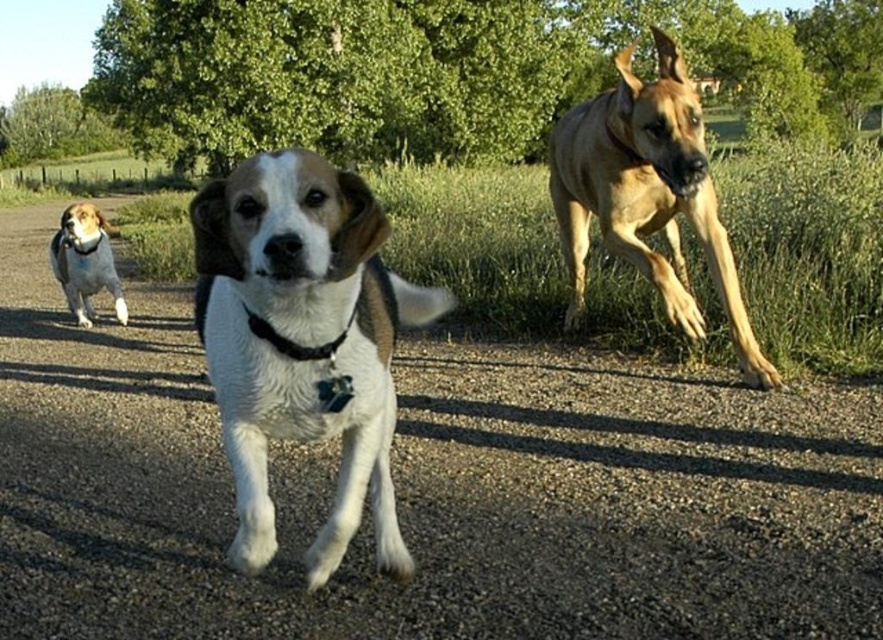
Question: Which point is farther from the camera taking this photo?

Choices:
 (A) (340, 342)
 (B) (13, 264)

Answer: (B)

Question: Can you confirm if brown gravel road at center is smaller than white fur dog at center?

Choices:
 (A) no
 (B) yes

Answer: (A)

Question: Which object is the closest to the white fur dog at left?

Choices:
 (A) golden tan fur at right
 (B) brown gravel road at center
 (C) black leather neckband at center

Answer: (B)

Question: Is brown gravel road at center wider than golden tan fur at right?

Choices:
 (A) no
 (B) yes

Answer: (B)

Question: Which point appears closest to the camera in this image?

Choices:
 (A) (342, 337)
 (B) (623, 545)

Answer: (A)

Question: Does white fur dog at left lie in front of black leather neckband at center?

Choices:
 (A) yes
 (B) no

Answer: (B)